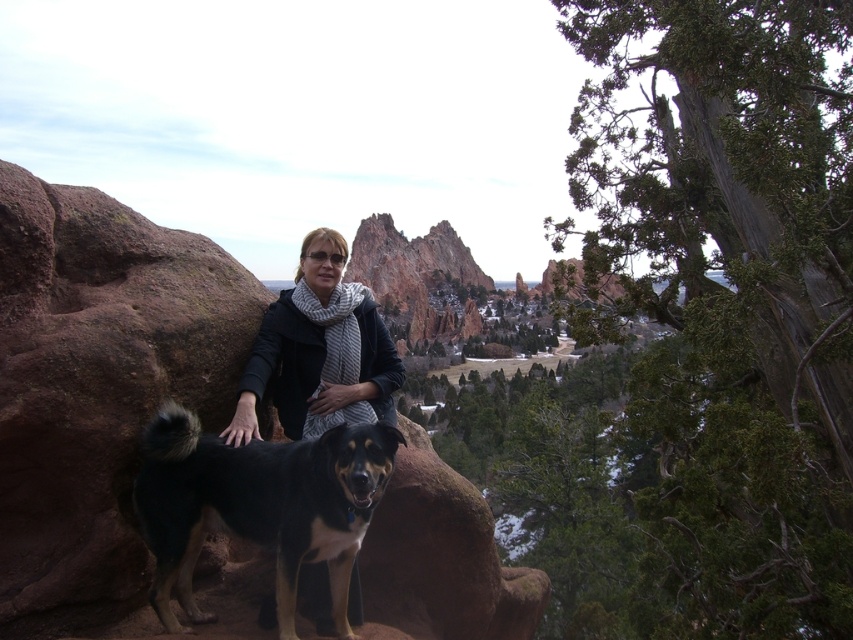
Question: Which object is farther from the camera taking this photo?

Choices:
 (A) black fur dog at center
 (B) black woolen scarf at center
 (C) brown rock at center

Answer: (B)

Question: Can you confirm if brown rock at center is thinner than black woolen scarf at center?

Choices:
 (A) yes
 (B) no

Answer: (B)

Question: Does brown rock at center have a larger size compared to black fur dog at center?

Choices:
 (A) no
 (B) yes

Answer: (B)

Question: Which point is closer to the camera taking this photo?

Choices:
 (A) (389, 369)
 (B) (189, 516)

Answer: (B)

Question: Can you confirm if brown rock at center is positioned to the left of black woolen scarf at center?

Choices:
 (A) no
 (B) yes

Answer: (B)

Question: Which is farther from the black woolen scarf at center?

Choices:
 (A) brown rock at center
 (B) black fur dog at center

Answer: (A)